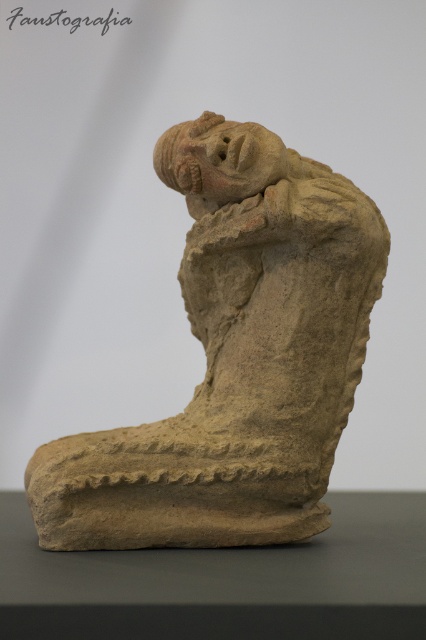
You are an archaeologist examining the ancient sculpture. You notice the earthy clay figure at center and the matte clay head at center. Which part of the sculpture is taller?

The earthy clay figure at center is much taller than the matte clay head at center.

You are an archaeologist examining the ancient sculpture. You notice two parts of the sculpture labeled as the earthy clay figure at center and the matte clay head at center. Which part is closer to you?

The earthy clay figure at center is closer to you since it is in front of the matte clay head at center.